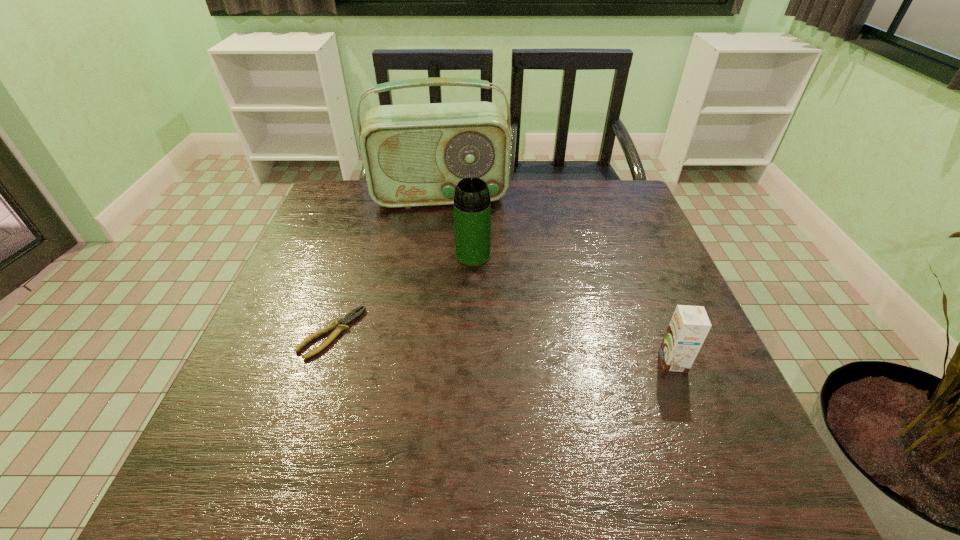
This screenshot has width=960, height=540. Identify the location of vacant region located from the spout of the thermos bottle. (478, 295).

I want to click on vacant area situated 0.350m from the spout of the thermos bottle, so click(491, 387).

Find the location of `free region located 0.260m on the front panel of the radio receiver`. free region located 0.260m on the front panel of the radio receiver is located at coordinates (450, 271).

I want to click on free spot located 0.180m on the front panel of the radio receiver, so click(x=448, y=251).

This screenshot has height=540, width=960. In order to click on free spot located 0.260m on the front panel of the radio receiver in this screenshot , I will do point(450,271).

This screenshot has height=540, width=960. What are the coordinates of `object that is positioned at the far edge` in the screenshot? It's located at (414, 155).

At what (x,y) coordinates should I click in order to perform the action: click on pliers situated at the left edge. Please return your answer as a coordinate pair (x, y). Image resolution: width=960 pixels, height=540 pixels. Looking at the image, I should click on (339, 326).

The image size is (960, 540). What are the coordinates of `radio receiver present at the left edge` in the screenshot? It's located at (414, 155).

The image size is (960, 540). I want to click on object located at the right edge, so click(689, 326).

Where is `object located in the far left corner section of the desktop`? The width and height of the screenshot is (960, 540). object located in the far left corner section of the desktop is located at coordinates (414, 155).